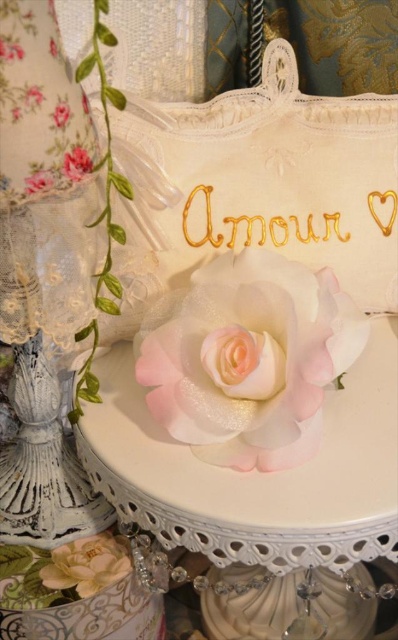
Question: Can you confirm if satin pink rose at center is positioned to the left of pink satin rose at center?

Choices:
 (A) yes
 (B) no

Answer: (B)

Question: Which point is closer to the camera taking this photo?

Choices:
 (A) (60, 120)
 (B) (37, 173)
 (C) (76, 168)

Answer: (A)

Question: Which of the following is the farthest from the observer?

Choices:
 (A) matte white flower at lower left
 (B) satin pink rose at center

Answer: (A)

Question: Does pink satin rose at upper center come behind pink satin rose at center?

Choices:
 (A) no
 (B) yes

Answer: (B)

Question: Can you confirm if matte white flower at lower left is positioned above pink satin rose at center?

Choices:
 (A) no
 (B) yes

Answer: (A)

Question: Which point appears farthest from the camera in this image?

Choices:
 (A) (33, 173)
 (B) (87, 154)
 (C) (93, 564)
 (D) (60, 108)

Answer: (C)